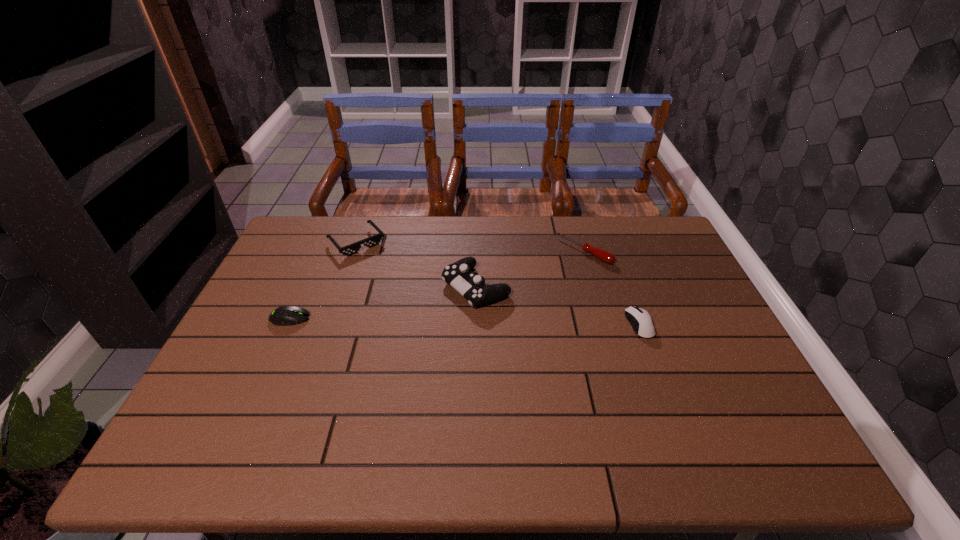
What are the coordinates of `the shorter mouse` in the screenshot? It's located at (287, 315).

Where is `the right mouse`? The image size is (960, 540). the right mouse is located at coordinates (640, 320).

I want to click on screwdriver, so click(603, 255).

In order to click on control in this screenshot , I will do `click(472, 287)`.

At what (x,y) coordinates should I click in order to perform the action: click on the tallest object. Please return your answer as a coordinate pair (x, y). Looking at the image, I should click on (472, 287).

Locate an element on the screen. sunglasses is located at coordinates tap(374, 240).

The width and height of the screenshot is (960, 540). In order to click on vacant space positioned on the wheel side of the left mouse in this screenshot , I will do `click(328, 318)`.

This screenshot has width=960, height=540. In order to click on blank space located 0.250m on the back of the right mouse in this screenshot , I will do `click(614, 256)`.

Where is `vacant region located at the tip of the screwdriver`? This screenshot has height=540, width=960. vacant region located at the tip of the screwdriver is located at coordinates (545, 281).

Where is `vacant space located 0.220m at the tip of the screwdriver`? The image size is (960, 540). vacant space located 0.220m at the tip of the screwdriver is located at coordinates (527, 296).